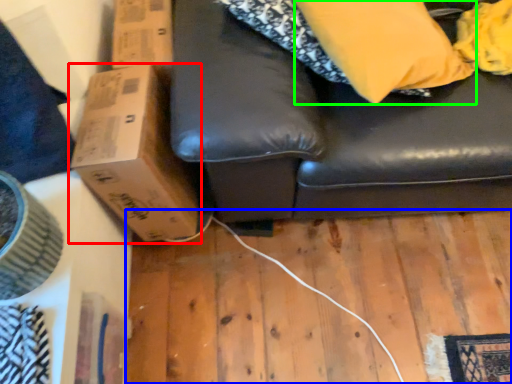
Question: Which is nearer to the cardboard box (highlighted by a red box)? plywood (highlighted by a blue box) or pillow (highlighted by a green box).

Choices:
 (A) plywood
 (B) pillow

Answer: (A)